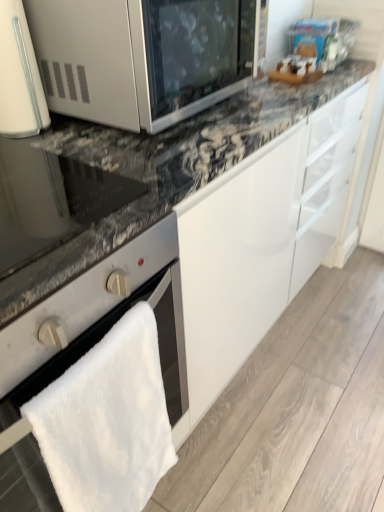
Question: Considering the positions of satin silver microwave at upper left and satin silver oven at lower left in the image, is satin silver microwave at upper left wider or thinner than satin silver oven at lower left?

Choices:
 (A) wide
 (B) thin

Answer: (B)

Question: From their relative heights in the image, would you say satin silver microwave at upper left is taller or shorter than satin silver oven at lower left?

Choices:
 (A) tall
 (B) short

Answer: (B)

Question: Which is nearer to the satin silver oven at lower left?

Choices:
 (A) satin silver microwave at upper left
 (B) white glossy microwave at upper left
 (C) matte black oven at left

Answer: (C)

Question: Which object is positioned closest to the white glossy microwave at upper left?

Choices:
 (A) satin silver oven at lower left
 (B) satin silver microwave at upper left
 (C) matte black oven at left

Answer: (B)